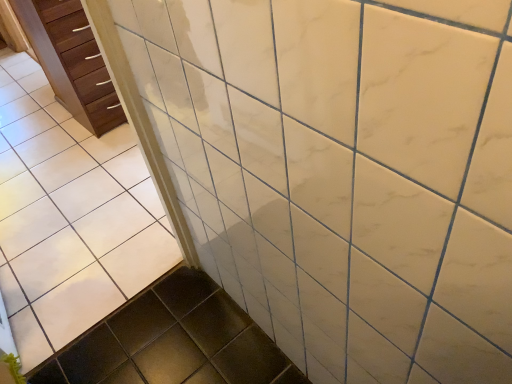
Question: Considering the relative sizes of wooden chest of drawers at left and white glossy tile at upper center in the image provided, is wooden chest of drawers at left shorter than white glossy tile at upper center?

Choices:
 (A) no
 (B) yes

Answer: (B)

Question: From the image's perspective, is wooden chest of drawers at left on top of white glossy tile at upper center?

Choices:
 (A) no
 (B) yes

Answer: (B)

Question: Does wooden chest of drawers at left have a greater height compared to white glossy tile at upper center?

Choices:
 (A) no
 (B) yes

Answer: (A)

Question: Is wooden chest of drawers at left not close to white glossy tile at upper center?

Choices:
 (A) no
 (B) yes

Answer: (A)

Question: Can you confirm if wooden chest of drawers at left is positioned to the left of white glossy tile at upper center?

Choices:
 (A) no
 (B) yes

Answer: (B)

Question: Is white glossy tile at upper center at the back of wooden chest of drawers at left?

Choices:
 (A) yes
 (B) no

Answer: (B)

Question: Considering the relative positions of white glossy tile at upper center and wooden chest of drawers at left in the image provided, is white glossy tile at upper center to the left of wooden chest of drawers at left from the viewer's perspective?

Choices:
 (A) no
 (B) yes

Answer: (A)

Question: Can you confirm if white glossy tile at upper center is shorter than wooden chest of drawers at left?

Choices:
 (A) no
 (B) yes

Answer: (A)

Question: From the image's perspective, does white glossy tile at upper center appear lower than wooden chest of drawers at left?

Choices:
 (A) yes
 (B) no

Answer: (A)

Question: Is white glossy tile at upper center taller than wooden chest of drawers at left?

Choices:
 (A) yes
 (B) no

Answer: (A)

Question: Does white glossy tile at upper center have a larger size compared to wooden chest of drawers at left?

Choices:
 (A) yes
 (B) no

Answer: (B)

Question: Can wooden chest of drawers at left be found inside white glossy tile at upper center?

Choices:
 (A) yes
 (B) no

Answer: (B)

Question: In terms of width, does wooden chest of drawers at left look wider or thinner when compared to white glossy tile at upper center?

Choices:
 (A) wide
 (B) thin

Answer: (A)